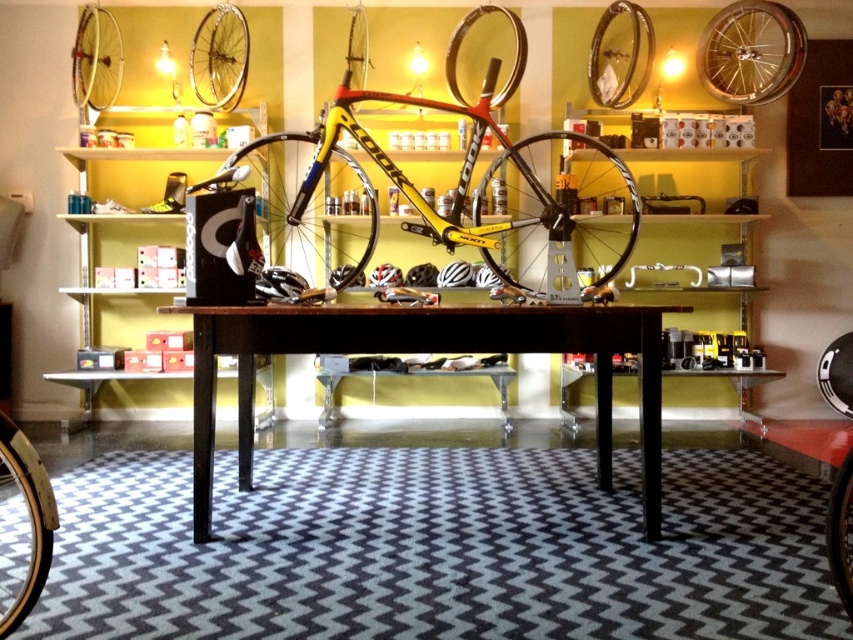
In the scene shown: You are a customer in a bicycle shop and want to know if the yellow matte bicycle at center is bigger than the black rubber tire at center. Can you confirm this?

The yellow matte bicycle at center is larger in size than the black rubber tire at center, so yes, the yellow matte bicycle at center is bigger than the black rubber tire at center.

You are standing in the bicycle shop and want to locate two specific points marked on the floor. The first point is at coordinates point (474, 339) and the second is at point (247, 51). Which point is closer to you?

Point (474, 339) is closer to the viewer than point (247, 51).

You are a customer in a bicycle shop and want to see both the brown wooden table at center and the shiny silver rim at upper center. Which object should you look at first to see both in your view?

You should look at the shiny silver rim at upper center first because the brown wooden table at center is to the right of it, so by starting at the shiny silver rim at upper center, you can easily shift your gaze to the right to include both objects in your view.